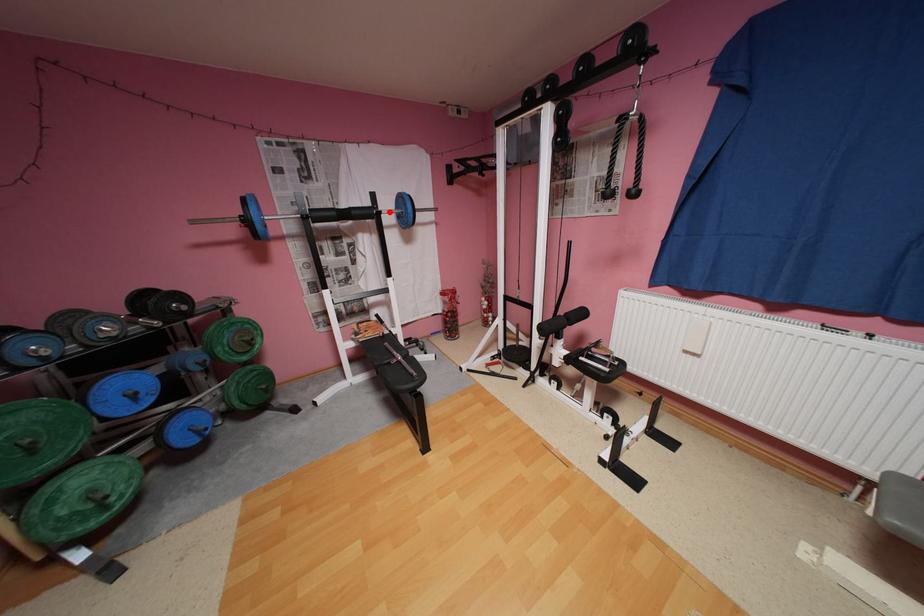
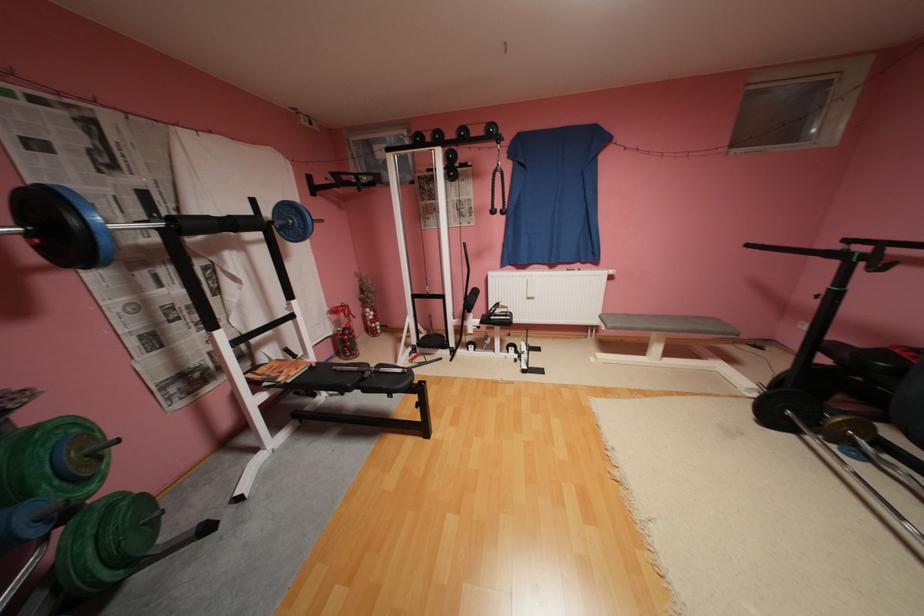
The point at the highlighted location is marked in the first image. Where is the corresponding point in the second image?

(281, 223)